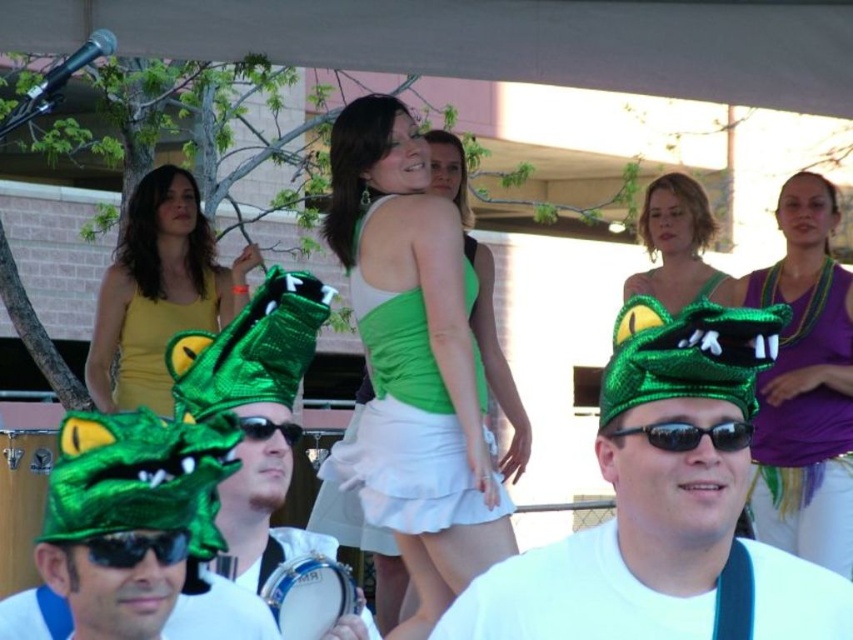
Between point (665, 595) and point (247, 432), which one is positioned in front?

Point (665, 595) is more forward.

Between green shiny crocodile hat at center and black reflective sunglasses at center, which one appears on the left side from the viewer's perspective?

black reflective sunglasses at center

This screenshot has height=640, width=853. I want to click on green shiny crocodile hat at center, so click(x=643, y=492).

Who is shorter, green sequined hat at upper center or black reflective sunglasses at center?

black reflective sunglasses at center is shorter.

Where is `green sequined hat at upper center`? green sequined hat at upper center is located at coordinates (677, 244).

Locate an element on the screen. Image resolution: width=853 pixels, height=640 pixels. green sequined hat at upper center is located at coordinates (677, 244).

Who is more forward, (686, 179) or (169, 531)?

Point (169, 531) is more forward.

The image size is (853, 640). What do you see at coordinates (677, 244) in the screenshot?
I see `green sequined hat at upper center` at bounding box center [677, 244].

Locate an element on the screen. green sequined hat at upper center is located at coordinates 677,244.